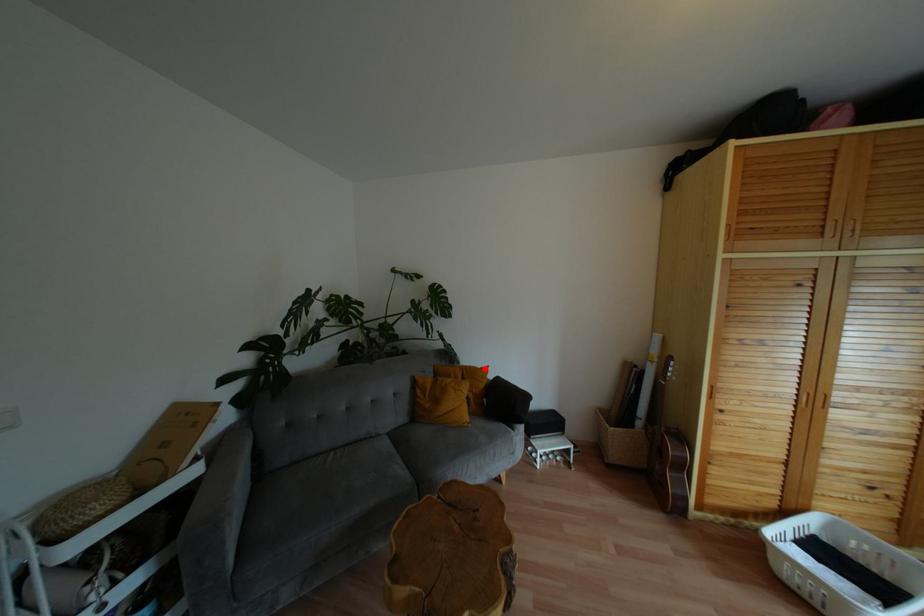
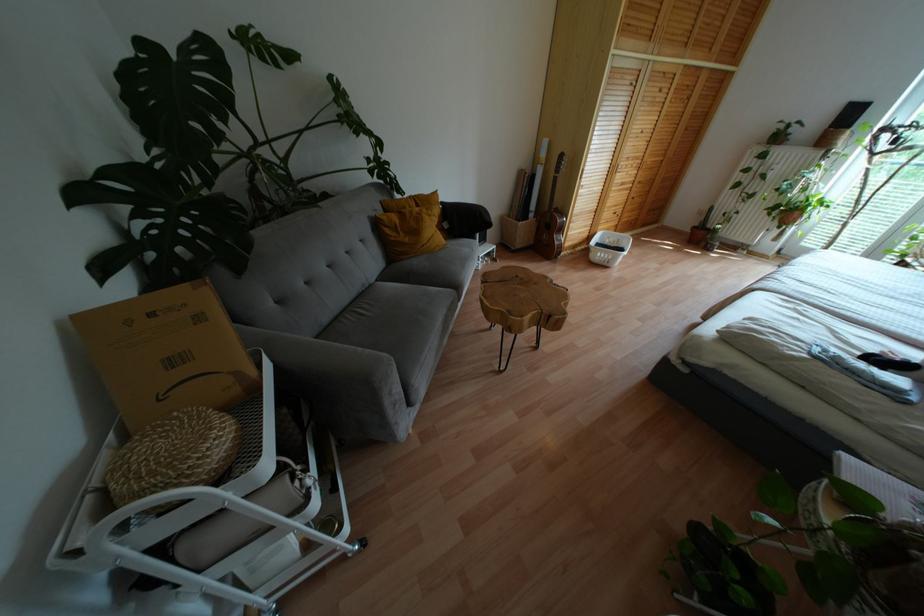
Locate, in the second image, the point that corresponds to the highlighted location in the first image.

(434, 193)